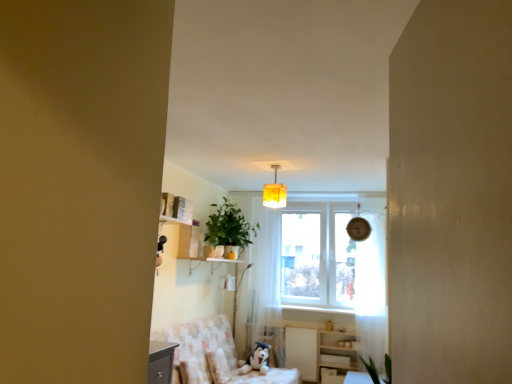
Question: Can you confirm if wooden table at lower right is bigger than yellow fabric lampshade at center?

Choices:
 (A) yes
 (B) no

Answer: (A)

Question: Considering the relative positions of wooden table at lower right and yellow fabric lampshade at center in the image provided, is wooden table at lower right behind yellow fabric lampshade at center?

Choices:
 (A) yes
 (B) no

Answer: (A)

Question: From a real-world perspective, is wooden table at lower right located higher than yellow fabric lampshade at center?

Choices:
 (A) no
 (B) yes

Answer: (A)

Question: Does wooden table at lower right have a lesser width compared to yellow fabric lampshade at center?

Choices:
 (A) no
 (B) yes

Answer: (A)

Question: Is wooden table at lower right looking in the opposite direction of yellow fabric lampshade at center?

Choices:
 (A) no
 (B) yes

Answer: (A)

Question: From a real-world perspective, is yellow fabric lampshade at center physically located above or below white sheer curtain at right, which appears as the first curtain when viewed from the right?

Choices:
 (A) above
 (B) below

Answer: (A)

Question: Is yellow fabric lampshade at center inside or outside of white sheer curtain at right, which appears as the second curtain when viewed from the left?

Choices:
 (A) outside
 (B) inside

Answer: (A)

Question: From the image's perspective, is yellow fabric lampshade at center positioned above or below white sheer curtain at right, which appears as the first curtain when viewed from the right?

Choices:
 (A) above
 (B) below

Answer: (A)

Question: In terms of size, does yellow fabric lampshade at center appear bigger or smaller than white sheer curtain at right, the 1th curtain in the front-to-back sequence?

Choices:
 (A) big
 (B) small

Answer: (B)

Question: In the image, is wooden table at lower right positioned in front of or behind fluffy fabric swivel chair at lower center?

Choices:
 (A) behind
 (B) front

Answer: (A)

Question: From a real-world perspective, is wooden table at lower right physically located above or below fluffy fabric swivel chair at lower center?

Choices:
 (A) above
 (B) below

Answer: (B)

Question: Considering the relative positions of wooden table at lower right and fluffy fabric swivel chair at lower center in the image provided, is wooden table at lower right to the left or to the right of fluffy fabric swivel chair at lower center?

Choices:
 (A) left
 (B) right

Answer: (B)

Question: Looking at the image, does wooden table at lower right seem bigger or smaller compared to fluffy fabric swivel chair at lower center?

Choices:
 (A) small
 (B) big

Answer: (A)

Question: Considering the positions of wooden table at lower right and white sheer curtain at center, the 2th curtain when ordered from right to left, in the image, is wooden table at lower right wider or thinner than white sheer curtain at center, the 2th curtain when ordered from right to left,?

Choices:
 (A) wide
 (B) thin

Answer: (A)

Question: From a real-world perspective, is wooden table at lower right physically located above or below white sheer curtain at center, the 2th curtain when ordered from right to left?

Choices:
 (A) below
 (B) above

Answer: (A)